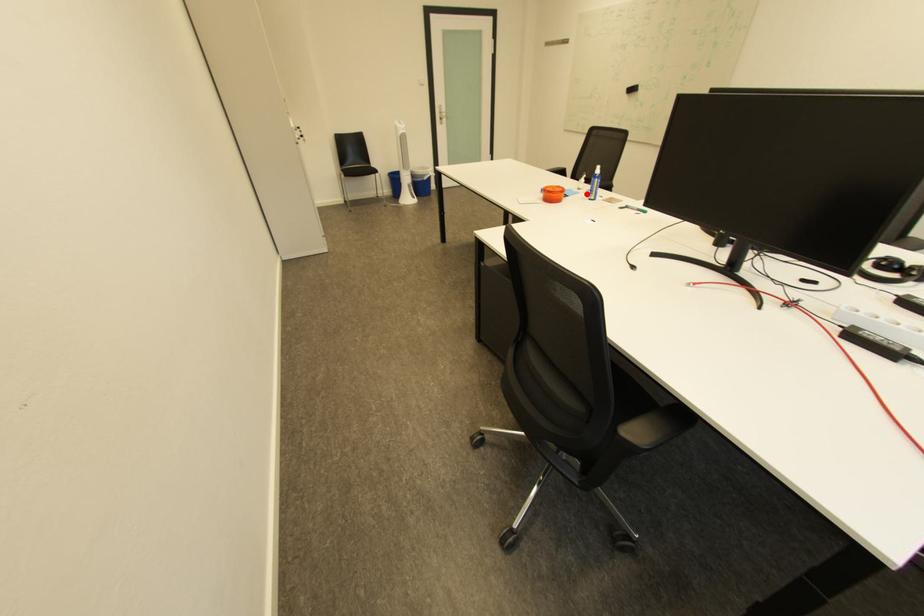
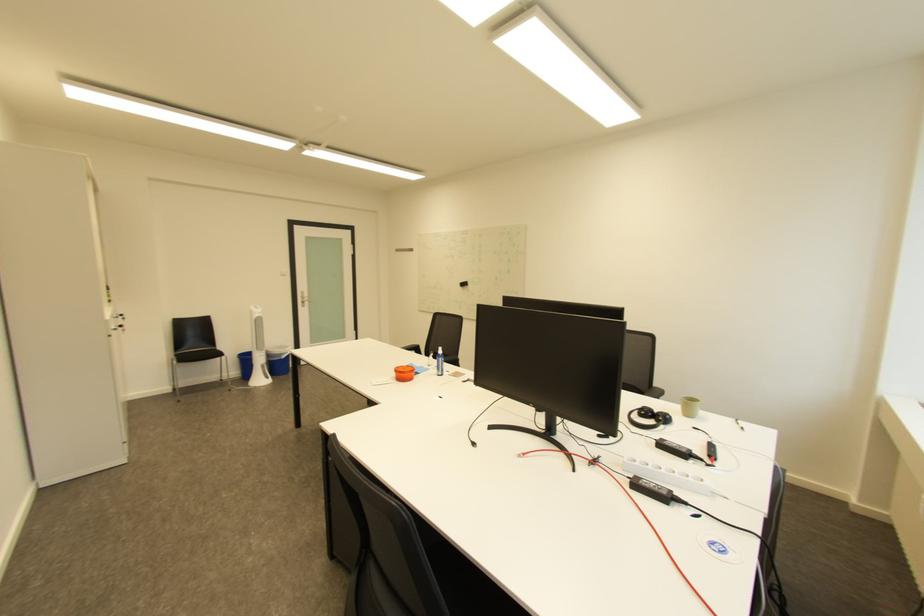
Where in the second image is the point corresponding to the highlighted location from the first image?

(436, 371)